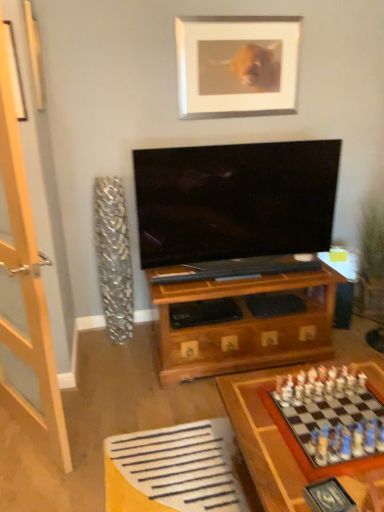
The image size is (384, 512). In order to click on free space in front of clear glass door at left in this screenshot , I will do `click(30, 476)`.